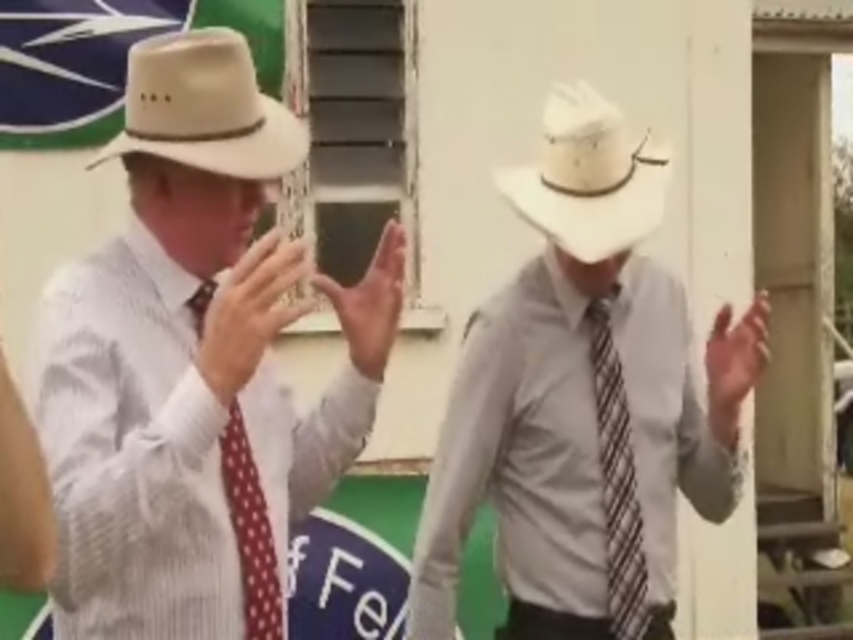
Between white straw cowboy hat at center and polka dot fabric tie at left, which one is positioned higher?

white straw cowboy hat at center is higher up.

Does point (553, 136) come in front of point (262, 499)?

No, it is not.

Image resolution: width=853 pixels, height=640 pixels. What do you see at coordinates (589, 177) in the screenshot?
I see `white straw cowboy hat at center` at bounding box center [589, 177].

I want to click on white straw cowboy hat at center, so click(x=589, y=177).

Between matte beige hat at left and white straw cowboy hat at center, which one has less height?

white straw cowboy hat at center

What do you see at coordinates (195, 364) in the screenshot? Image resolution: width=853 pixels, height=640 pixels. I see `matte beige hat at left` at bounding box center [195, 364].

Is point (126, 516) less distant than point (587, 138)?

That is True.

You are a GUI agent. You are given a task and a screenshot of the screen. Output one action in this format:
    pyautogui.click(x=<x>, y=<y>)
    Task: Click on the matte beige hat at left
    The image size is (853, 640).
    Given the screenshot: What is the action you would take?
    pyautogui.click(x=195, y=364)

Does matte white cowboy hat at center have a larger size compared to beige felt fedora at upper left?

Yes.

Which is behind, point (636, 282) or point (172, 45)?

The point (636, 282) is more distant.

Where is `matte white cowboy hat at center`? matte white cowboy hat at center is located at coordinates 581,388.